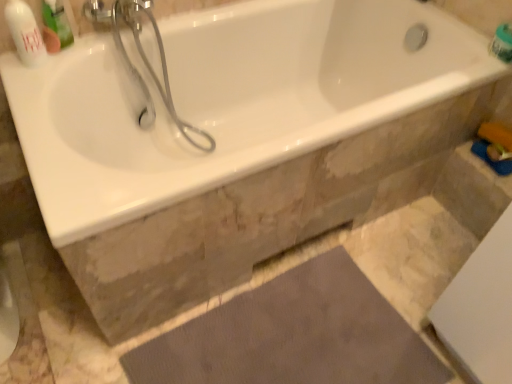
Image resolution: width=512 pixels, height=384 pixels. In order to click on free location in front of white glossy bottle at upper left, which ranks as the 2th toiletry in right-to-left order in this screenshot , I will do `click(27, 89)`.